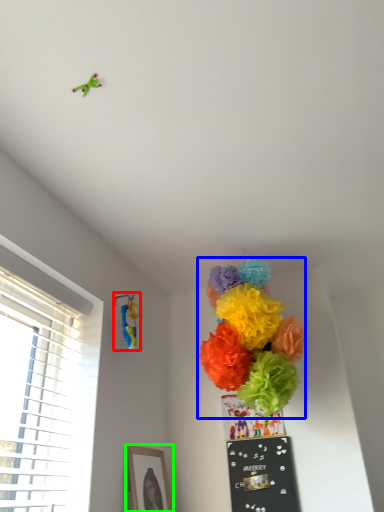
Question: Which object is the farthest from toy (highlighted by a red box)? Choose among these: flower (highlighted by a blue box) or picture frame (highlighted by a green box).

Choices:
 (A) flower
 (B) picture frame

Answer: (B)